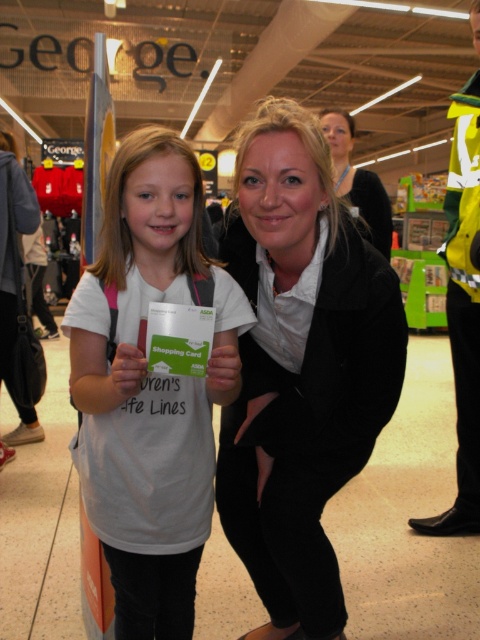
Question: Which point is farther to the camera?

Choices:
 (A) white matte t-shirt at center
 (B) black matte coat at center

Answer: (B)

Question: Among these points, which one is farthest from the camera?

Choices:
 (A) (249, 186)
 (B) (237, 339)
 (C) (387, 205)

Answer: (C)

Question: Is black matte coat at center below white matte t-shirt at center?

Choices:
 (A) yes
 (B) no

Answer: (A)

Question: Which point is closer to the camera?

Choices:
 (A) white matte t-shirt at center
 (B) matte black jacket at upper center

Answer: (A)

Question: Can you confirm if white matte t-shirt at center is smaller than matte black jacket at upper center?

Choices:
 (A) yes
 (B) no

Answer: (A)

Question: Is black matte coat at center positioned before white matte t-shirt at center?

Choices:
 (A) yes
 (B) no

Answer: (B)